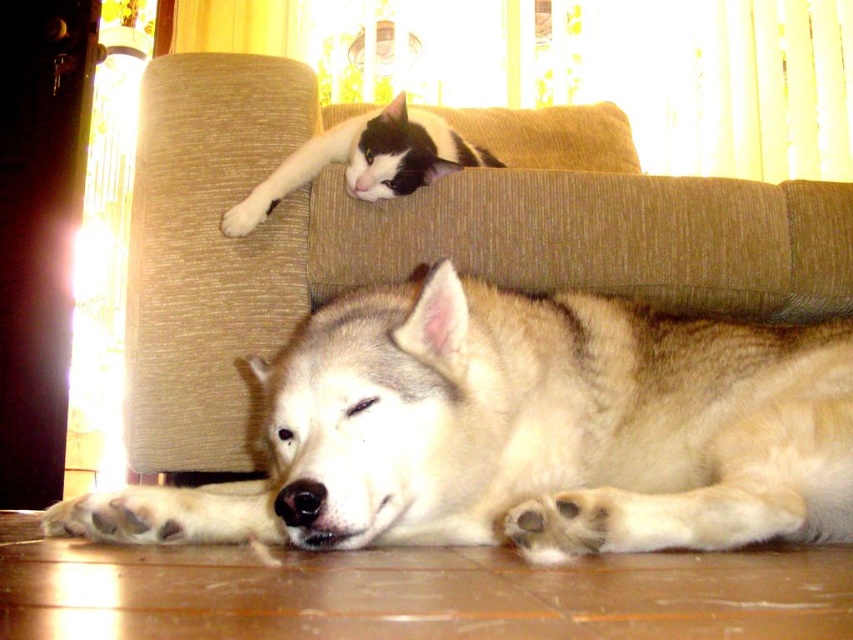
You are a pet sitter who needs to place a 30 inch long blanket between the fuzzy beige dog at lower center and the black and white fur cat at upper center. Can you fit the blanket between them without moving either animal?

The distance between the fuzzy beige dog at lower center and the black and white fur cat at upper center is 27.30 inches. Since the blanket is 30 inches long, it cannot be placed between them without moving the animals because the space available is shorter than the blanket.

You are standing in the room depicted in the image. There is a point marked at coordinates (524, 429). Which object from the scene is located at that point?

The point at coordinates (524, 429) marks the fuzzy beige dog at lower center.